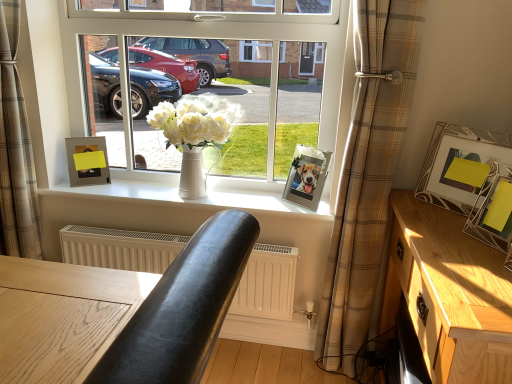
Question: Considering the relative sizes of plaid fabric curtain at center, which appears as the second curtain when viewed from the left, and wooden table at center, placed as the 1th table when sorted from front to back, in the image provided, is plaid fabric curtain at center, which appears as the second curtain when viewed from the left, bigger than wooden table at center, placed as the 1th table when sorted from front to back,?

Choices:
 (A) no
 (B) yes

Answer: (A)

Question: Considering the relative sizes of plaid fabric curtain at center, which appears as the second curtain when viewed from the left, and wooden table at center, placed as the 1th table when sorted from front to back, in the image provided, is plaid fabric curtain at center, which appears as the second curtain when viewed from the left, taller than wooden table at center, placed as the 1th table when sorted from front to back,?

Choices:
 (A) yes
 (B) no

Answer: (A)

Question: Does plaid fabric curtain at center, arranged as the 1th curtain when viewed from the right, contain wooden table at center, placed as the 1th table when sorted from front to back?

Choices:
 (A) yes
 (B) no

Answer: (B)

Question: Can you confirm if plaid fabric curtain at center, arranged as the 1th curtain when viewed from the right, is wider than wooden table at center, placed as the 1th table when sorted from front to back?

Choices:
 (A) no
 (B) yes

Answer: (A)

Question: Is plaid fabric curtain at center, arranged as the 1th curtain when viewed from the right, further to camera compared to wooden table at center, placed as the second table when sorted from back to front?

Choices:
 (A) no
 (B) yes

Answer: (B)

Question: Can you confirm if plaid fabric curtain at center, arranged as the 1th curtain when viewed from the right, is positioned to the right of wooden table at center, which is the 2th table from right to left?

Choices:
 (A) yes
 (B) no

Answer: (A)

Question: From the image's perspective, does metallic silver photo frame at center, positioned as the third picture frame in right-to-left order, appear lower than white smooth vase at center?

Choices:
 (A) yes
 (B) no

Answer: (B)

Question: Can you confirm if metallic silver photo frame at center, positioned as the third picture frame in right-to-left order, is wider than white smooth vase at center?

Choices:
 (A) no
 (B) yes

Answer: (A)

Question: Does metallic silver photo frame at center, positioned as the third picture frame in right-to-left order, appear on the right side of white smooth vase at center?

Choices:
 (A) no
 (B) yes

Answer: (B)

Question: Is metallic silver photo frame at center, which is the second picture frame in left-to-right order, outside of white smooth vase at center?

Choices:
 (A) yes
 (B) no

Answer: (A)

Question: Is metallic silver photo frame at center, which is the second picture frame in left-to-right order, facing away from white smooth vase at center?

Choices:
 (A) no
 (B) yes

Answer: (A)

Question: Is metallic silver photo frame at center, the second picture frame viewed from the back, aimed at white smooth vase at center?

Choices:
 (A) yes
 (B) no

Answer: (B)

Question: Can you confirm if yellow paper picture frame at right, which is the fourth picture frame in left-to-right order, is taller than wooden table at center, placed as the second table when sorted from back to front?

Choices:
 (A) no
 (B) yes

Answer: (A)